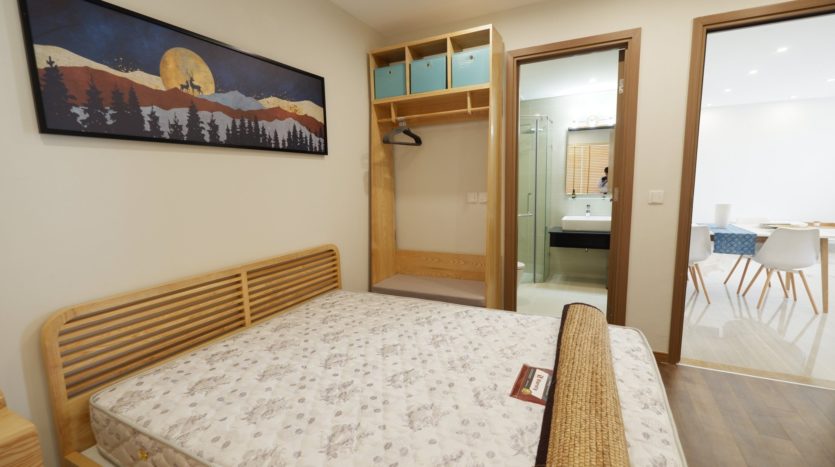
This screenshot has width=835, height=467. Identify the location of headboard. (185, 320).